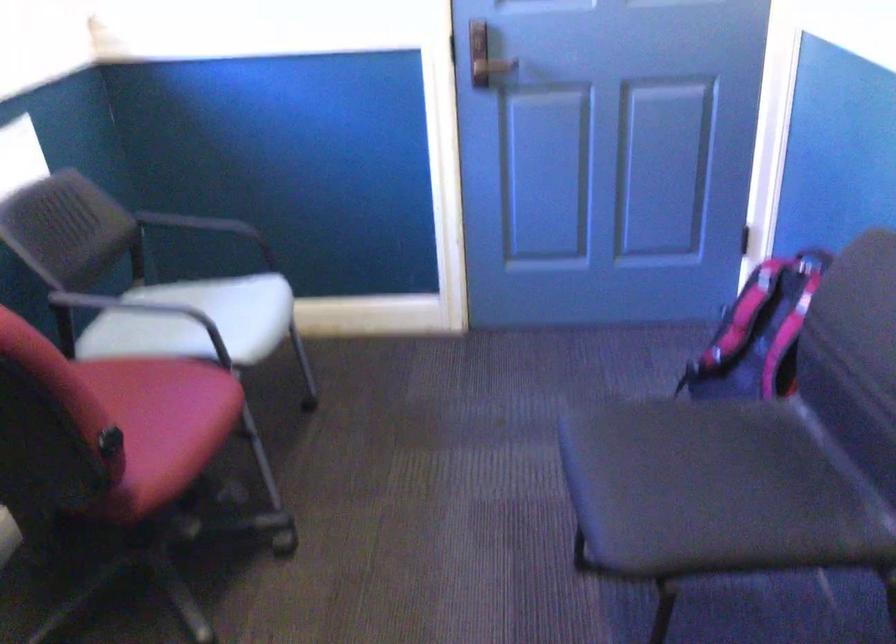
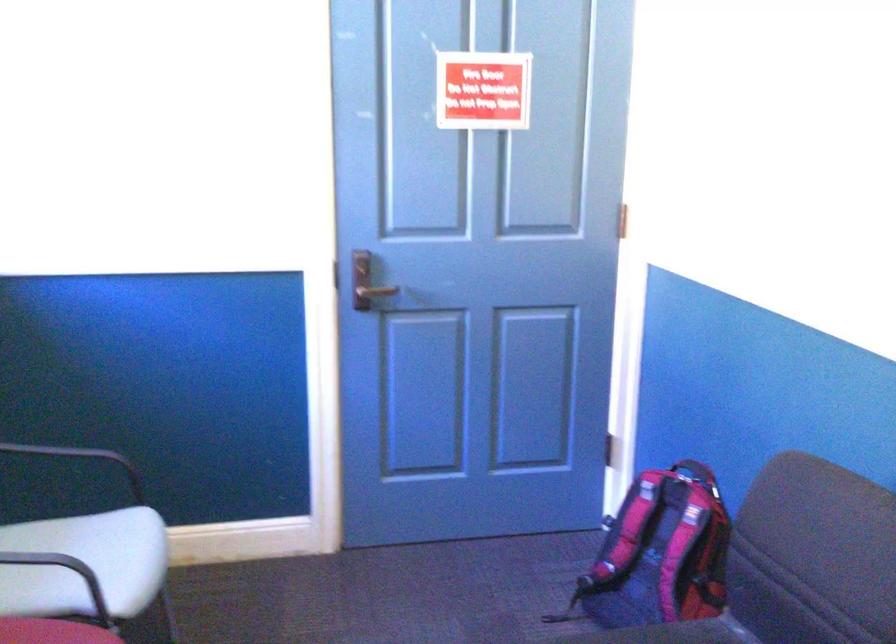
Question: The first image is from the beginning of the video and the second image is from the end. How did the camera likely rotate when shooting the video?

Choices:
 (A) Left
 (B) Right
 (C) Up
 (D) Down

Answer: (C)